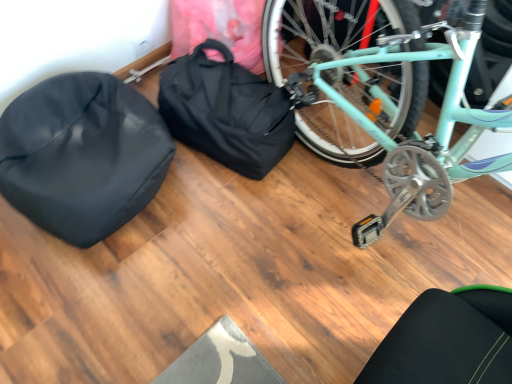
The width and height of the screenshot is (512, 384). Identify the location of vacant region to the right of black fabric bag at center. [320, 158].